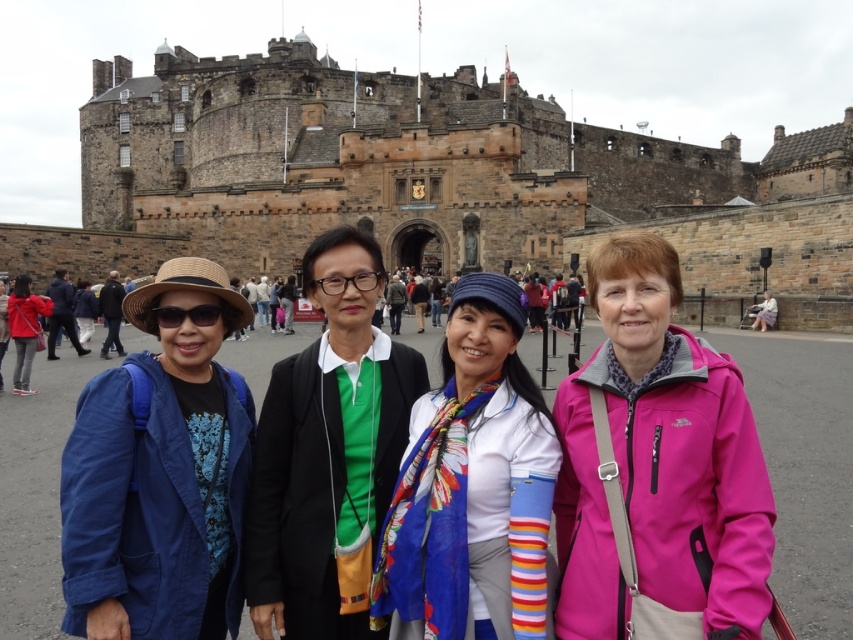
You are standing in front of Edinburgh Castle and want to take a photo. You notice two points marked in the scene. The first point is at coordinate point(705,436) and the second at point(329,417). Which point is closer to your current position?

Point(705,436) is closer to the camera than point(329,417), so the first point is closer to your current position.